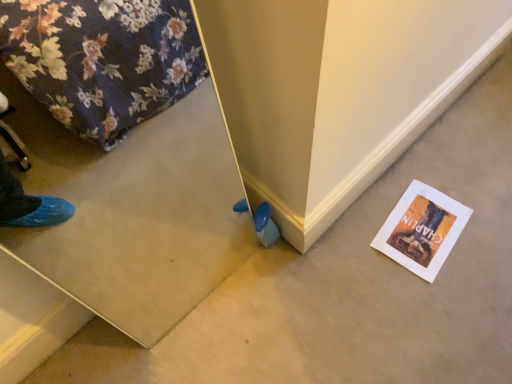
Where is `vacant space in front of white paper at lower right`? The height and width of the screenshot is (384, 512). vacant space in front of white paper at lower right is located at coordinates (435, 299).